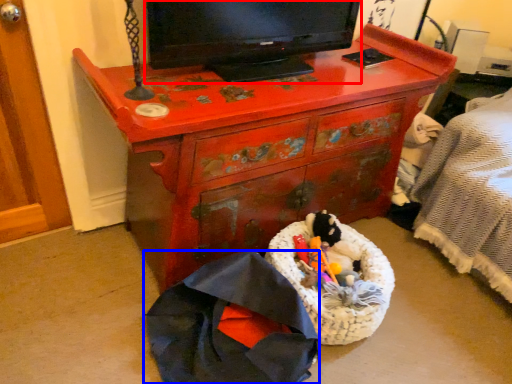
Question: Which object is closer to the camera taking this photo, television (highlighted by a red box) or clothing (highlighted by a blue box)?

Choices:
 (A) television
 (B) clothing

Answer: (B)